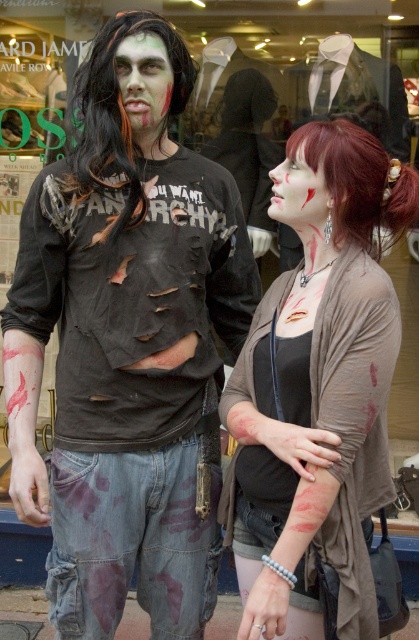
Is matte brown cardigan at center bigger than matte skin face at center?

Correct, matte brown cardigan at center is larger in size than matte skin face at center.

Who is lower down, matte brown cardigan at center or matte skin face at center?

matte brown cardigan at center

The height and width of the screenshot is (640, 419). What do you see at coordinates (318, 403) in the screenshot?
I see `matte brown cardigan at center` at bounding box center [318, 403].

What are the coordinates of `matte brown cardigan at center` in the screenshot? It's located at (318, 403).

In the scene shown: Does dark brown synthetic wig at upper right have a larger size compared to matte skin face at center?

Indeed, dark brown synthetic wig at upper right has a larger size compared to matte skin face at center.

Who is taller, dark brown synthetic wig at upper right or matte skin face at center?

Standing taller between the two is dark brown synthetic wig at upper right.

Is point (413, 189) positioned in front of point (305, 186)?

No, it is not.

This screenshot has width=419, height=640. What are the coordinates of `dark brown synthetic wig at upper right` in the screenshot? It's located at (357, 179).

Who is positioned more to the left, ripped denim shirt at center or black synthetic wig at upper left?

black synthetic wig at upper left is more to the left.

Is ripped denim shirt at center smaller than black synthetic wig at upper left?

Actually, ripped denim shirt at center might be larger than black synthetic wig at upper left.

Who is more distant from viewer, [51,193] or [111,172]?

The point [51,193] is more distant.

The width and height of the screenshot is (419, 640). Find the location of `ripped denim shirt at center`. ripped denim shirt at center is located at coordinates (132, 384).